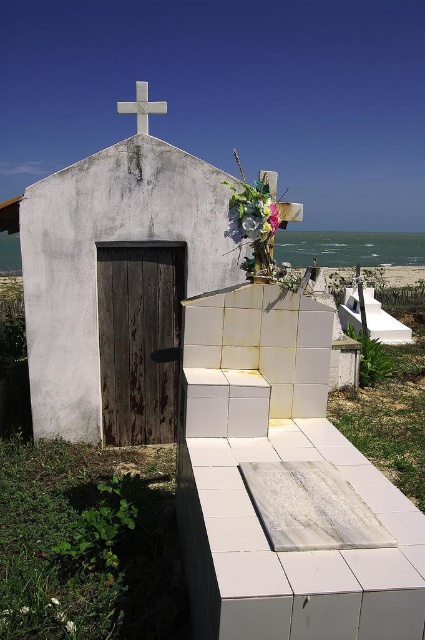
Question: Which point is farther from the camera taking this photo?

Choices:
 (A) (27, 352)
 (B) (269, 205)
 (C) (116, 106)

Answer: (C)

Question: Does white matte cross at upper center appear over white marble cross at upper center?

Choices:
 (A) no
 (B) yes

Answer: (A)

Question: Which point is farther from the camera taking this photo?

Choices:
 (A) (136, 125)
 (B) (132, 195)

Answer: (B)

Question: Can you confirm if white matte cross at upper center is positioned to the left of white matte flower at upper center?

Choices:
 (A) no
 (B) yes

Answer: (B)

Question: Can you confirm if white matte cross at upper center is thinner than white marble cross at upper center?

Choices:
 (A) no
 (B) yes

Answer: (B)

Question: Among these points, which one is farthest from the camera?

Choices:
 (A) (127, 333)
 (B) (271, 212)
 (C) (133, 113)

Answer: (A)